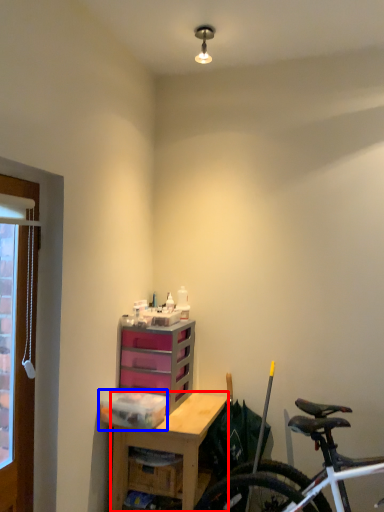
Question: Which object appears closest to the camera in this image, desk (highlighted by a red box) or storage box (highlighted by a blue box)?

Choices:
 (A) desk
 (B) storage box

Answer: (A)